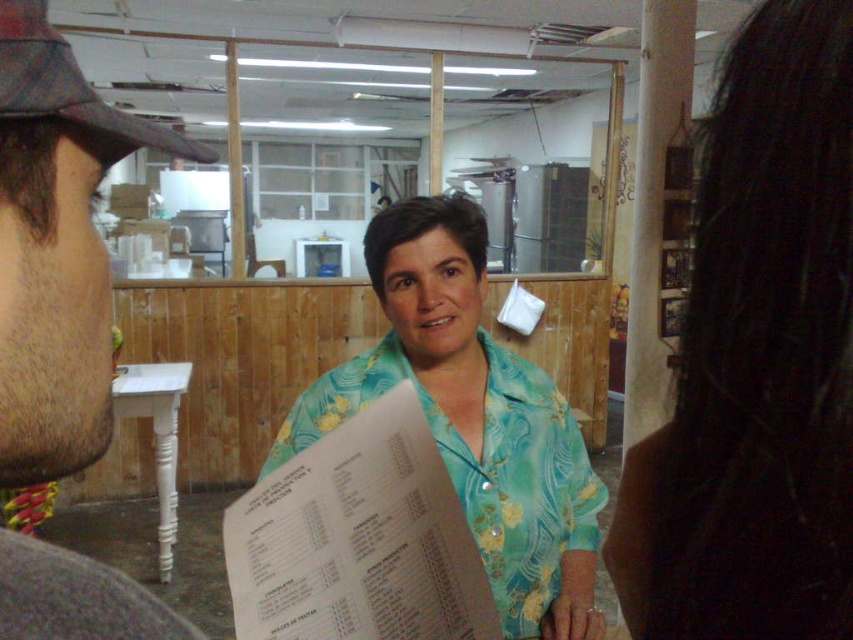
Between point (163, 144) and point (585, 496), which one is positioned behind?

The point (585, 496) is more distant.

This screenshot has height=640, width=853. What do you see at coordinates (55, 250) in the screenshot?
I see `brown fuzzy hat at left` at bounding box center [55, 250].

Is point (16, 17) in front of point (471, 321)?

Yes, point (16, 17) is closer to viewer.

This screenshot has height=640, width=853. I want to click on brown fuzzy hat at left, so click(x=55, y=250).

In the scene shown: Does blue floral shirt at center have a larger size compared to turquoise floral shirt at center?

No.

Can you confirm if blue floral shirt at center is positioned to the left of turquoise floral shirt at center?

In fact, blue floral shirt at center is to the right of turquoise floral shirt at center.

Find the location of a particular element. blue floral shirt at center is located at coordinates (757, 362).

Between blue floral shirt at center and brown fuzzy hat at left, which one is positioned higher?

Positioned higher is brown fuzzy hat at left.

Is blue floral shirt at center smaller than brown fuzzy hat at left?

Correct, blue floral shirt at center occupies less space than brown fuzzy hat at left.

This screenshot has width=853, height=640. What do you see at coordinates (757, 362) in the screenshot? I see `blue floral shirt at center` at bounding box center [757, 362].

This screenshot has width=853, height=640. I want to click on blue floral shirt at center, so click(x=757, y=362).